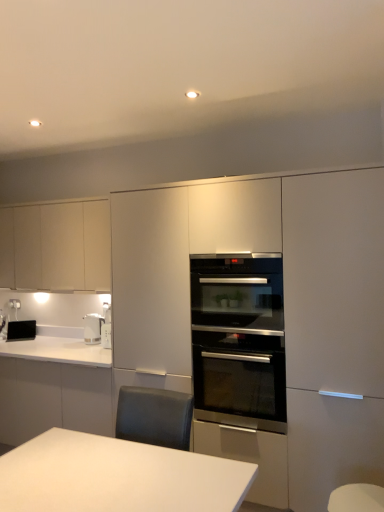
Question: Considering the relative positions of stainless steel oven at center and white glossy countertop at lower left in the image provided, is stainless steel oven at center in front of white glossy countertop at lower left?

Choices:
 (A) no
 (B) yes

Answer: (B)

Question: Is stainless steel oven at center aimed at white glossy countertop at lower left?

Choices:
 (A) no
 (B) yes

Answer: (A)

Question: Is stainless steel oven at center smaller than white glossy countertop at lower left?

Choices:
 (A) no
 (B) yes

Answer: (B)

Question: From a real-world perspective, is stainless steel oven at center physically below white glossy countertop at lower left?

Choices:
 (A) yes
 (B) no

Answer: (B)

Question: Does stainless steel oven at center have a lesser width compared to white glossy countertop at lower left?

Choices:
 (A) no
 (B) yes

Answer: (B)

Question: Looking at the image, does black glossy toaster at lower left seem bigger or smaller compared to white glossy electric kettle at left?

Choices:
 (A) small
 (B) big

Answer: (B)

Question: Does point (8, 322) appear closer or farther from the camera than point (86, 326)?

Choices:
 (A) farther
 (B) closer

Answer: (A)

Question: From a real-world perspective, relative to white glossy electric kettle at left, is black glossy toaster at lower left vertically above or below?

Choices:
 (A) below
 (B) above

Answer: (A)

Question: Would you say black glossy toaster at lower left is inside or outside white glossy electric kettle at left?

Choices:
 (A) outside
 (B) inside

Answer: (A)

Question: From a real-world perspective, is stainless steel oven at center positioned above or below stainless steel oven at center?

Choices:
 (A) above
 (B) below

Answer: (B)

Question: Which is correct: stainless steel oven at center is inside stainless steel oven at center, or outside of it?

Choices:
 (A) outside
 (B) inside

Answer: (A)

Question: From their relative heights in the image, would you say stainless steel oven at center is taller or shorter than stainless steel oven at center?

Choices:
 (A) short
 (B) tall

Answer: (B)

Question: From the image's perspective, relative to stainless steel oven at center, is stainless steel oven at center above or below?

Choices:
 (A) below
 (B) above

Answer: (A)

Question: Is matte white oven at center, which is counted as the 2th cabinetry, starting from the left, bigger or smaller than white glossy countertop at lower left?

Choices:
 (A) big
 (B) small

Answer: (A)

Question: Is matte white oven at center, the first cabinetry when ordered from right to left, taller or shorter than white glossy countertop at lower left?

Choices:
 (A) tall
 (B) short

Answer: (A)